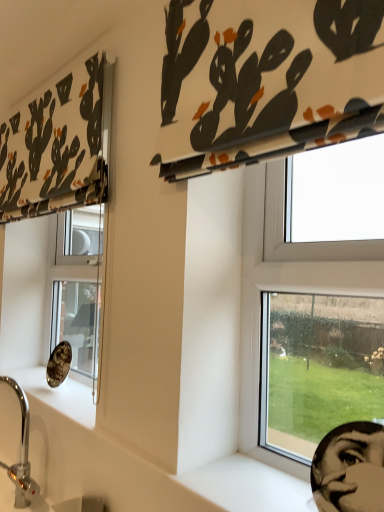
Question: Can you confirm if black matte human face at lower right is wider than chrome metallic sink at lower left?

Choices:
 (A) yes
 (B) no

Answer: (B)

Question: Is black matte human face at lower right far away from chrome metallic sink at lower left?

Choices:
 (A) yes
 (B) no

Answer: (B)

Question: Can you confirm if black matte human face at lower right is taller than chrome metallic sink at lower left?

Choices:
 (A) yes
 (B) no

Answer: (B)

Question: Can you confirm if black matte human face at lower right is smaller than chrome metallic sink at lower left?

Choices:
 (A) no
 (B) yes

Answer: (B)

Question: From a real-world perspective, is black matte human face at lower right located higher than chrome metallic sink at lower left?

Choices:
 (A) no
 (B) yes

Answer: (B)

Question: Is black matte human face at lower right closer to camera compared to chrome metallic sink at lower left?

Choices:
 (A) no
 (B) yes

Answer: (B)

Question: From a real-world perspective, is chrome metallic sink at lower left under white smooth window sill at lower right?

Choices:
 (A) yes
 (B) no

Answer: (A)

Question: Is chrome metallic sink at lower left smaller than white smooth window sill at lower right?

Choices:
 (A) no
 (B) yes

Answer: (A)

Question: From a real-world perspective, is chrome metallic sink at lower left physically above white smooth window sill at lower right?

Choices:
 (A) yes
 (B) no

Answer: (B)

Question: Is chrome metallic sink at lower left closer to the viewer compared to white smooth window sill at lower right?

Choices:
 (A) no
 (B) yes

Answer: (A)

Question: Is chrome metallic sink at lower left taller than white smooth window sill at lower right?

Choices:
 (A) no
 (B) yes

Answer: (B)

Question: Is white smooth window sill at lower right inside chrome metallic sink at lower left?

Choices:
 (A) yes
 (B) no

Answer: (B)

Question: Is white fabric with black and orange cactus print at upper left, the 1th curtain in the left-to-right sequence, taller than transparent glass window at center right?

Choices:
 (A) no
 (B) yes

Answer: (A)